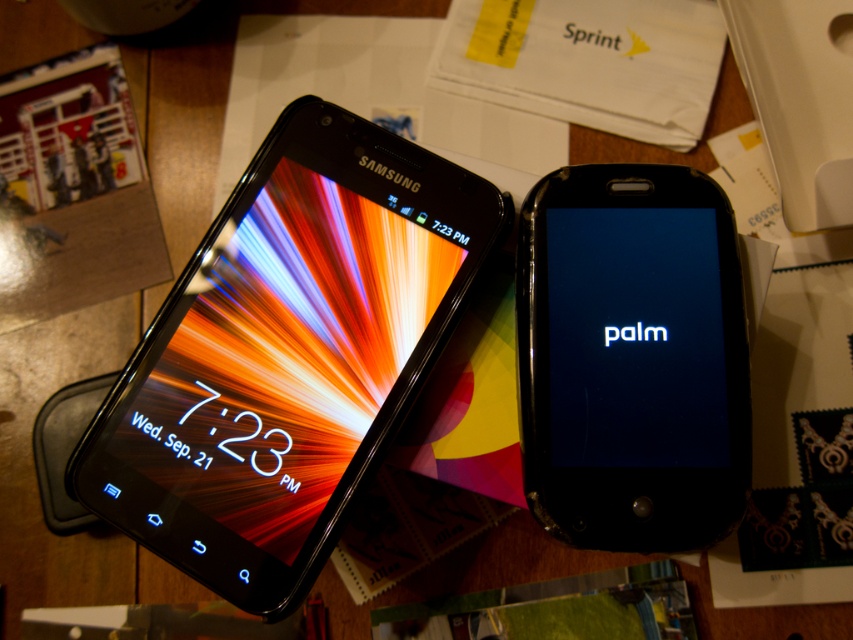
Question: Which point is farther to the camera?

Choices:
 (A) (625, 492)
 (B) (426, 273)

Answer: (B)

Question: Is matte black smartphone at center further to the viewer compared to black glossy phone at center?

Choices:
 (A) no
 (B) yes

Answer: (B)

Question: Considering the relative positions of matte black smartphone at center and black glossy phone at center in the image provided, where is matte black smartphone at center located with respect to black glossy phone at center?

Choices:
 (A) below
 (B) above

Answer: (B)

Question: Is matte black smartphone at center above black glossy phone at center?

Choices:
 (A) yes
 (B) no

Answer: (A)